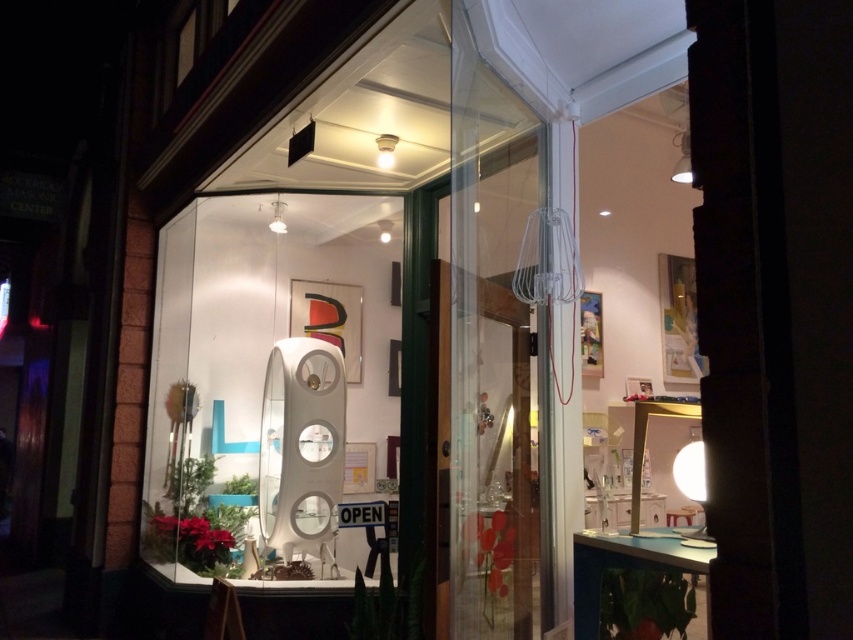
You are standing at the entrance of the modern interior design shop. You want to locate the white glossy mirror at center. According to the coordinates provided, in which direction should you look relative to your position?

The white glossy mirror at center is located at coordinates point [270,378]. Since the coordinate system is not specified, it is recommended to look towards the central area of the shop where the mirror is likely positioned.

You are standing at the entrance of the modern interior design shop and see two points marked on the floor. The first point is labeled as point (186, 273) and the second is point (450, 445). If you want to move from the entrance towards the back of the shop, which point will you encounter first?

Point (450, 445) will be encountered first because point (186, 273) is behind it, meaning it is further away from the entrance.

You are a delivery person trying to enter the shop through the transparent glass door at center. The white glossy mirror at center is blocking your path. Can you walk around the mirror to reach the door?

The white glossy mirror at center is taller than transparent glass door at center, so it might block your path. However, since mirrors are flat and not bulky, you can walk around it to reach the transparent glass door at center.